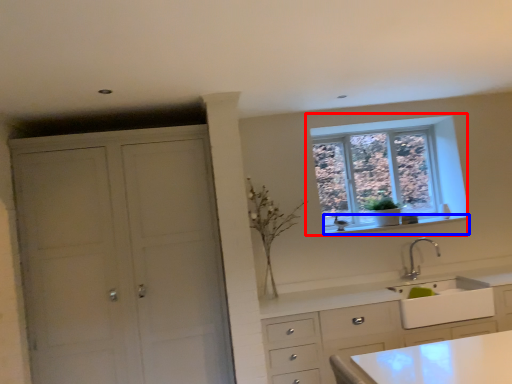
Question: Among these objects, which one is nearest to the camera, window (highlighted by a red box) or window sill (highlighted by a blue box)?

Choices:
 (A) window
 (B) window sill

Answer: (B)